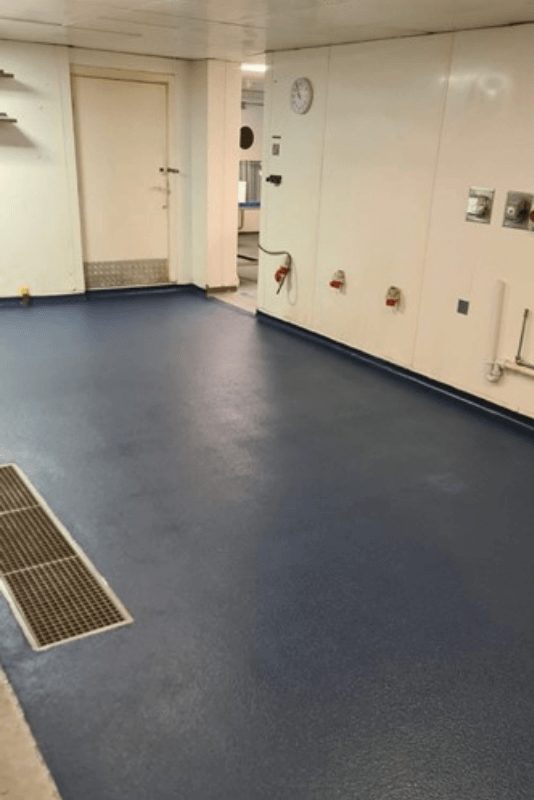
Identify the location of floor. The image size is (534, 800). (300, 509).